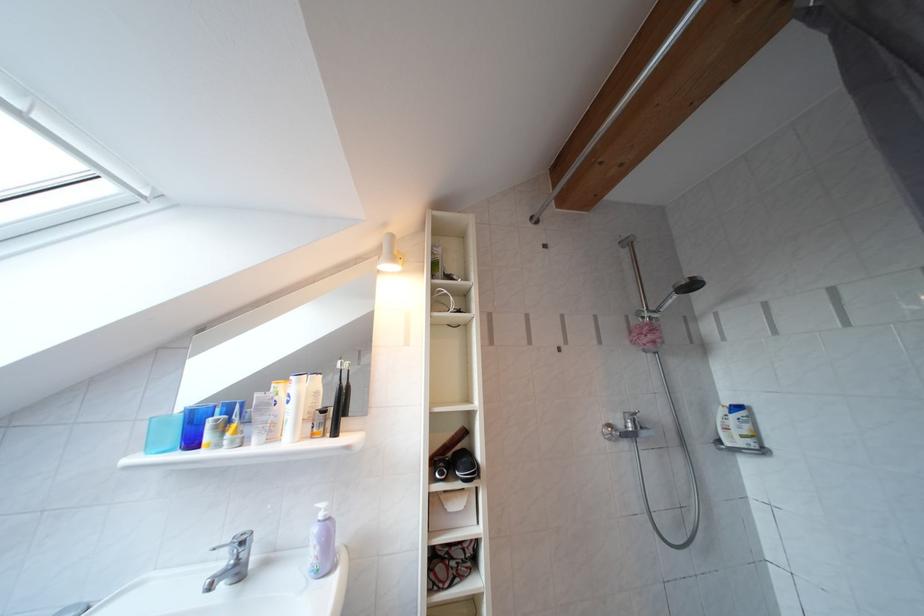
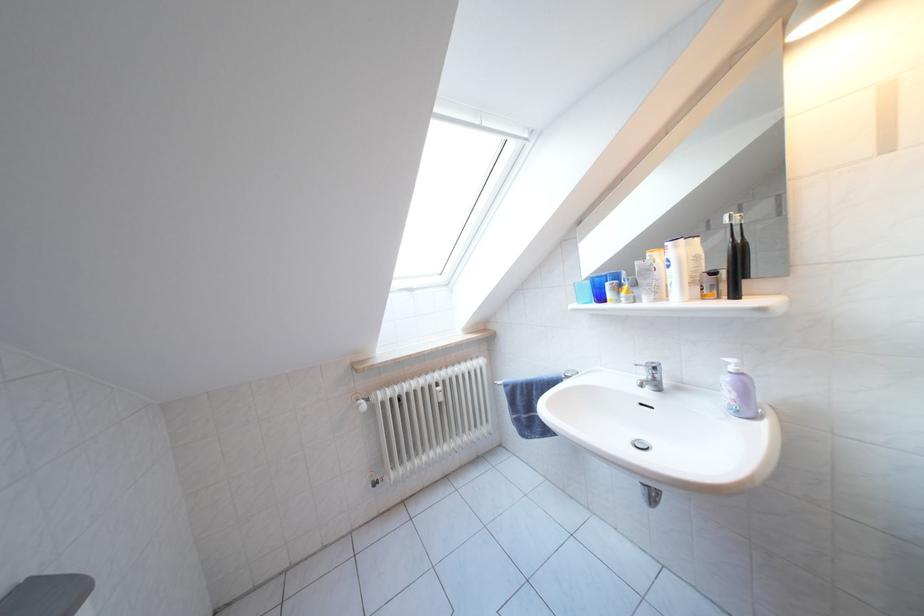
Question: The images are taken continuously from a first-person perspective. In which direction is your viewpoint rotating?

Choices:
 (A) Left
 (B) Right
 (C) Up
 (D) Down

Answer: (A)